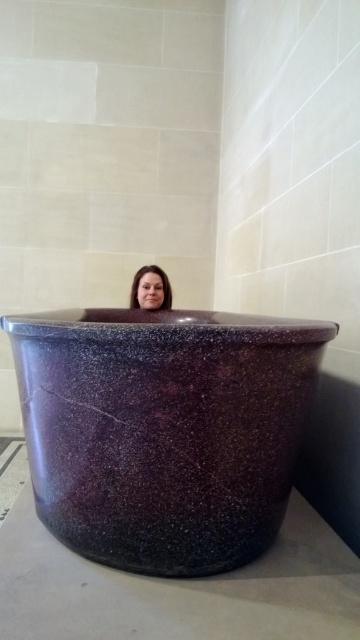
Based on the photo, you are designing a bathroom layout and need to ensure that the purple speckled stone at center and the matte purple stone woman at center will fit within a 1.5 meter wide space. Given their sizes, can both objects be placed side by side without exceeding the width?

The purple speckled stone at center is wider than the matte purple stone woman at center. Since the combined width of both objects would exceed the 1.5 meter space, they cannot be placed side by side without exceeding the width.

From the picture: You are designing a bathroom layout and need to ensure there is enough space for both the purple speckled stone at center and the matte purple stone woman at center. Based on their sizes, which object requires more space?

The purple speckled stone at center requires more space because it is bigger than the matte purple stone woman at center.

You are designing a bathroom layout and need to ensure there is enough vertical space between the purple speckled stone at center and the matte purple stone woman at center. Based on the scene, which object takes up more vertical space?

The purple speckled stone at center is much taller than the matte purple stone woman at center, so it occupies more vertical space.